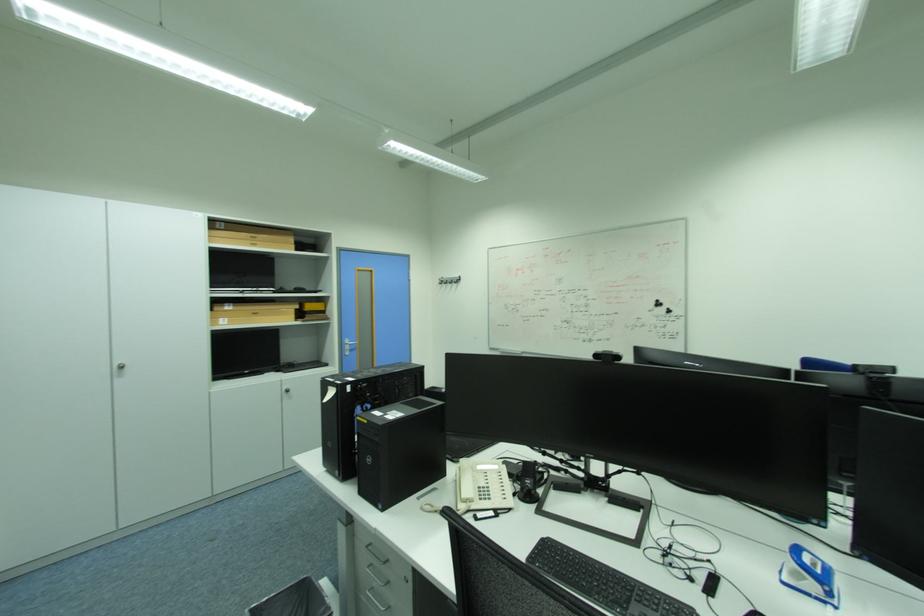
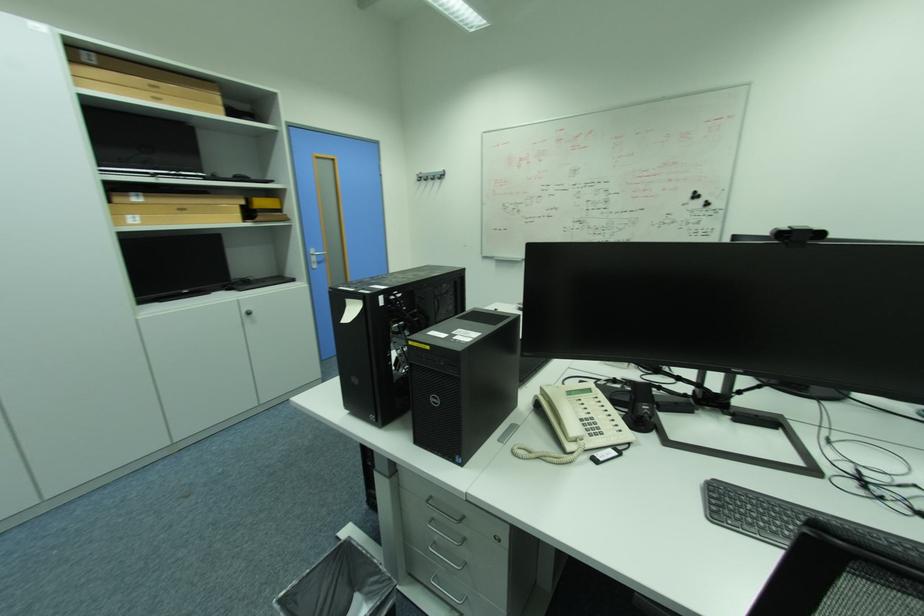
Locate, in the second image, the point that corresponds to (228,320) in the first image.

(136, 217)